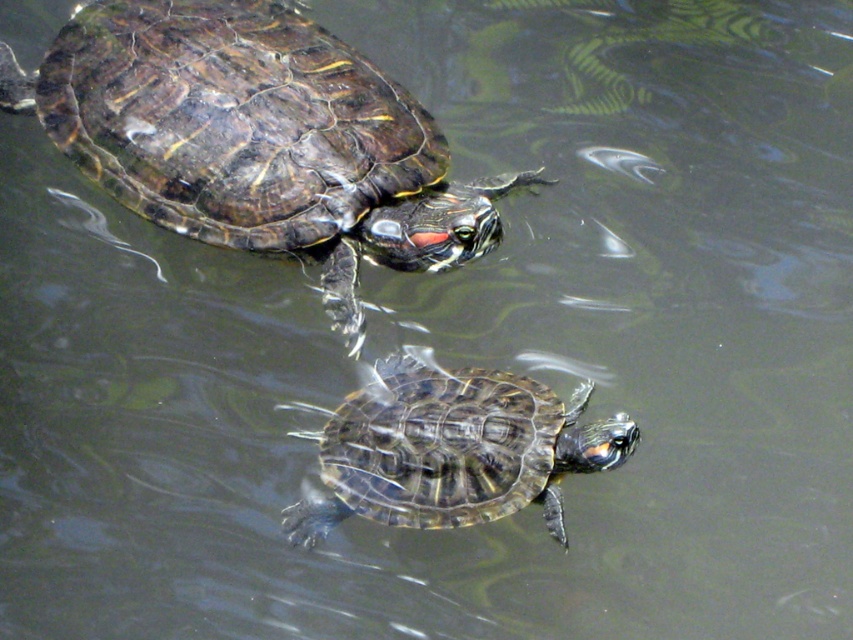
Question: Is shiny dark green tortoise at upper left smaller than shiny brown tortoise at center?

Choices:
 (A) no
 (B) yes

Answer: (A)

Question: Which object is closer to the camera taking this photo?

Choices:
 (A) shiny brown tortoise at center
 (B) shiny dark green tortoise at upper left

Answer: (A)

Question: Among these objects, which one is nearest to the camera?

Choices:
 (A) shiny dark green tortoise at upper left
 (B) shiny brown tortoise at center

Answer: (B)

Question: Does shiny dark green tortoise at upper left have a smaller size compared to shiny brown tortoise at center?

Choices:
 (A) yes
 (B) no

Answer: (B)

Question: Among these points, which one is nearest to the camera?

Choices:
 (A) (173, 112)
 (B) (590, 445)

Answer: (B)

Question: Considering the relative positions of shiny dark green tortoise at upper left and shiny brown tortoise at center in the image provided, where is shiny dark green tortoise at upper left located with respect to shiny brown tortoise at center?

Choices:
 (A) right
 (B) left

Answer: (B)